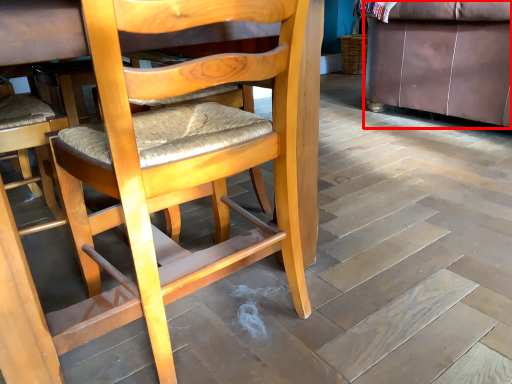
Question: Considering the relative positions of studio couch (annotated by the red box) and chair in the image provided, where is studio couch (annotated by the red box) located with respect to the staircase?

Choices:
 (A) left
 (B) right

Answer: (B)